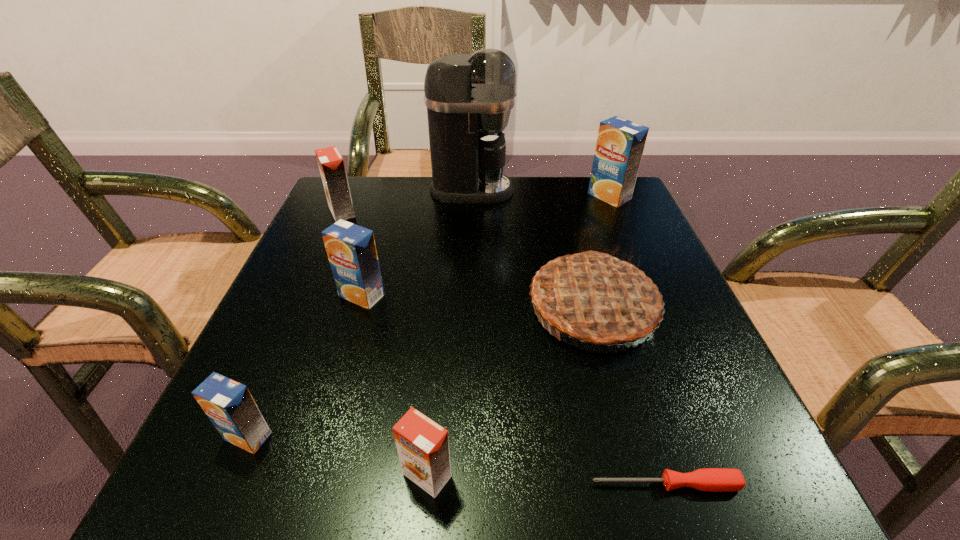
Identify the location of blue orange_juice that is the third closest one to the coffee maker. The width and height of the screenshot is (960, 540). point(229,405).

Locate which blue orange_juice ranks in proximity to the left orange orange juice. Please provide its 2D coordinates. Your answer should be formatted as a tuple, i.e. [(x, y)], where the tuple contains the x and y coordinates of a point satisfying the conditions above.

[(351, 249)]

Where is `free location that satisfies the following two spatial constraints: 1. place cup under the spout of the coffee maker; 2. on the left side of the pie`? The width and height of the screenshot is (960, 540). free location that satisfies the following two spatial constraints: 1. place cup under the spout of the coffee maker; 2. on the left side of the pie is located at coordinates (468, 307).

You are a GUI agent. You are given a task and a screenshot of the screen. Output one action in this format:
    pyautogui.click(x=<x>, y=<y>)
    Task: Click on the vacant region that satisfies the following two spatial constraints: 1. place cup under the spout of the coffee maker; 2. on the front side of the farther orange orange juice
    This screenshot has width=960, height=540.
    Given the screenshot: What is the action you would take?
    pyautogui.click(x=471, y=212)

I want to click on blank space that satisfies the following two spatial constraints: 1. on the front side of the nearest blue orange_juice; 2. on the left side of the farther orange orange juice, so click(x=245, y=436).